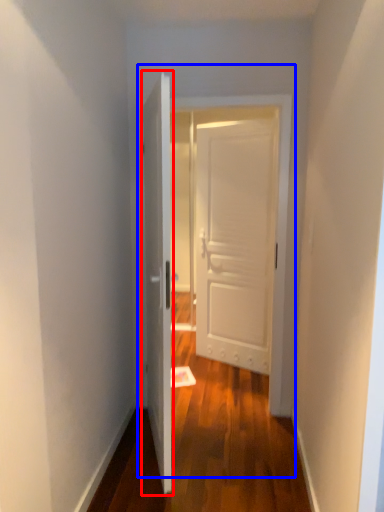
Question: Among these objects, which one is nearest to the camera, door (highlighted by a red box) or door (highlighted by a blue box)?

Choices:
 (A) door
 (B) door

Answer: (A)